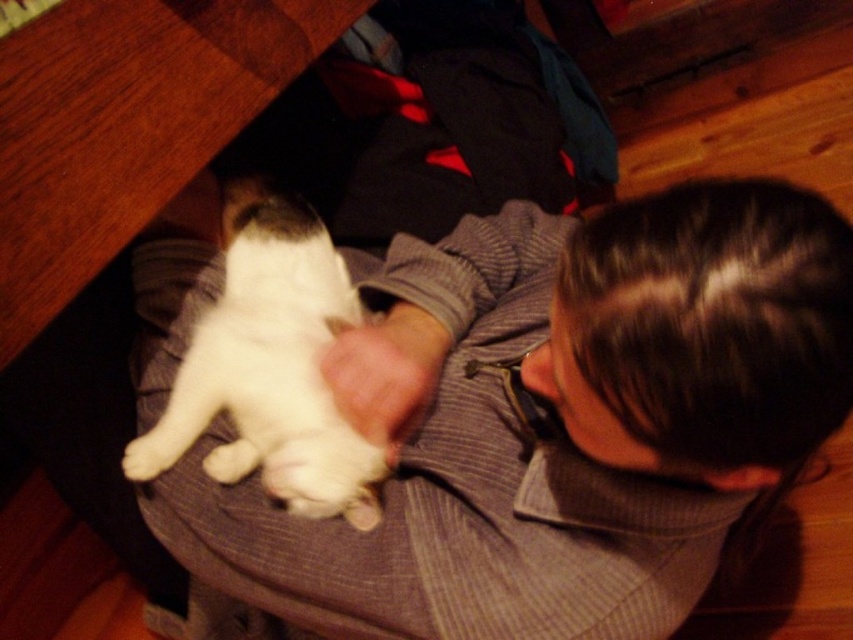
You are a photographer trying to capture the striped sweater at center and the white fur cat at center in a single shot. Based on their positions, can you tell which object is closer to the camera?

The striped sweater at center is positioned under the white fur cat at center, so the white fur cat at center is closer to the camera than the striped sweater at center.

You are a photographer trying to capture a close shot of the striped sweater at center and the white fur cat at center. Since the camera can only focus on one subject at a time, which object should you choose to ensure it fills the frame properly?

The striped sweater at center is much taller than the white fur cat at center, so you should focus on the striped sweater at center to ensure it fills the frame properly.